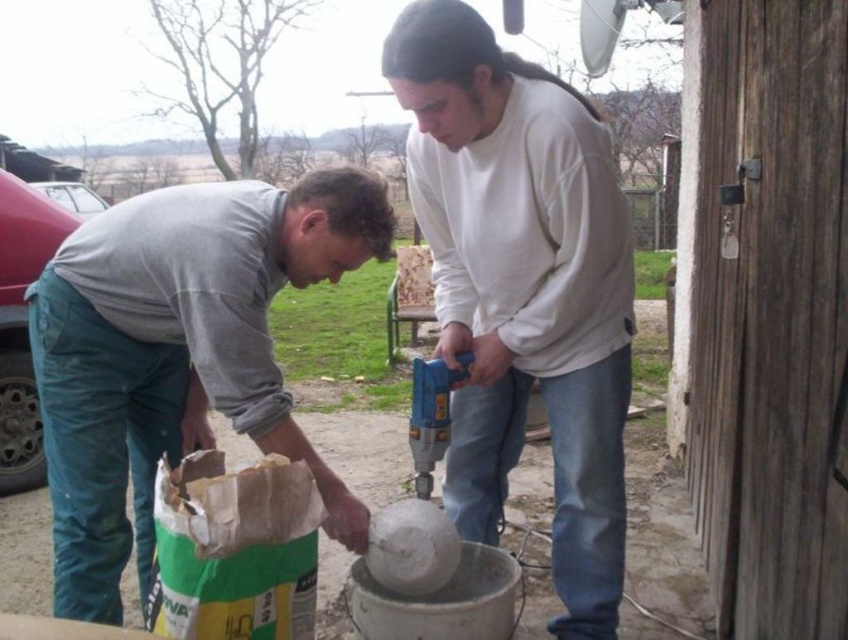
Is green paper bag at lower left wider than blue plastic drill at center?

Correct, the width of green paper bag at lower left exceeds that of blue plastic drill at center.

Does green paper bag at lower left appear on the right side of blue plastic drill at center?

No, green paper bag at lower left is not to the right of blue plastic drill at center.

Between point (252, 499) and point (433, 387), which one is positioned in front?

Point (252, 499) is more forward.

Find the location of a particular element. This screenshot has height=640, width=848. green paper bag at lower left is located at coordinates (233, 548).

Measure the distance from white matte drill at center to gray fabric shirt at lower left.

white matte drill at center and gray fabric shirt at lower left are 21.52 inches apart from each other.

What do you see at coordinates (522, 288) in the screenshot? I see `white matte drill at center` at bounding box center [522, 288].

Locate an element on the screen. Image resolution: width=848 pixels, height=640 pixels. white matte drill at center is located at coordinates (522, 288).

Locate an element on the screen. This screenshot has width=848, height=640. white matte drill at center is located at coordinates (522, 288).

Between white matte drill at center and green paper bag at lower left, which one appears on the right side from the viewer's perspective?

Positioned to the right is white matte drill at center.

Does point (495, 93) come farther from viewer compared to point (183, 582)?

Yes.

Image resolution: width=848 pixels, height=640 pixels. I want to click on white matte drill at center, so click(522, 288).